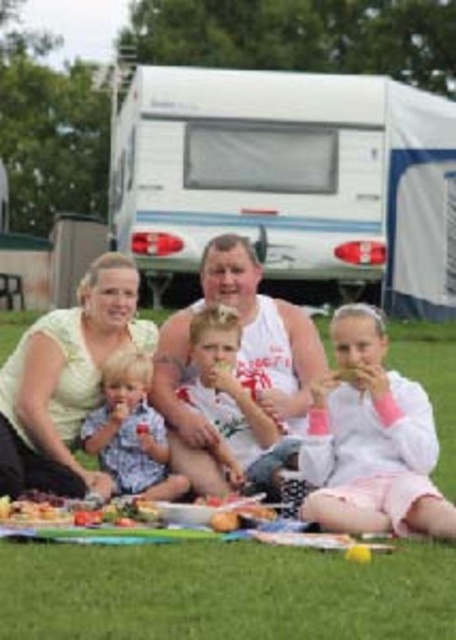
Question: Estimate the real-world distances between objects in this image. Which object is farther from the light brown hair at center?

Choices:
 (A) white cotton tank top at center
 (B) green grass at lower center

Answer: (B)

Question: Considering the real-world distances, which object is farthest from the light brown hair at center?

Choices:
 (A) green grass at lower center
 (B) green matte shirt at center
 (C) smooth white tank top at center
 (D) white cotton tank top at center

Answer: (A)

Question: Estimate the real-world distances between objects in this image. Which object is closer to the white cotton shirt at center?

Choices:
 (A) white plastic recreational vehicle at upper center
 (B) green grass at lower center
 (C) shiny plastic plate at center

Answer: (C)

Question: Can you confirm if white cotton tank top at center is positioned to the right of light brown hair at center?

Choices:
 (A) yes
 (B) no

Answer: (A)

Question: Can you confirm if smooth white tank top at center is thinner than shiny plastic plate at center?

Choices:
 (A) no
 (B) yes

Answer: (B)

Question: Observing the image, what is the correct spatial positioning of white cotton shirt at center in reference to light brown hair at center?

Choices:
 (A) left
 (B) right

Answer: (B)